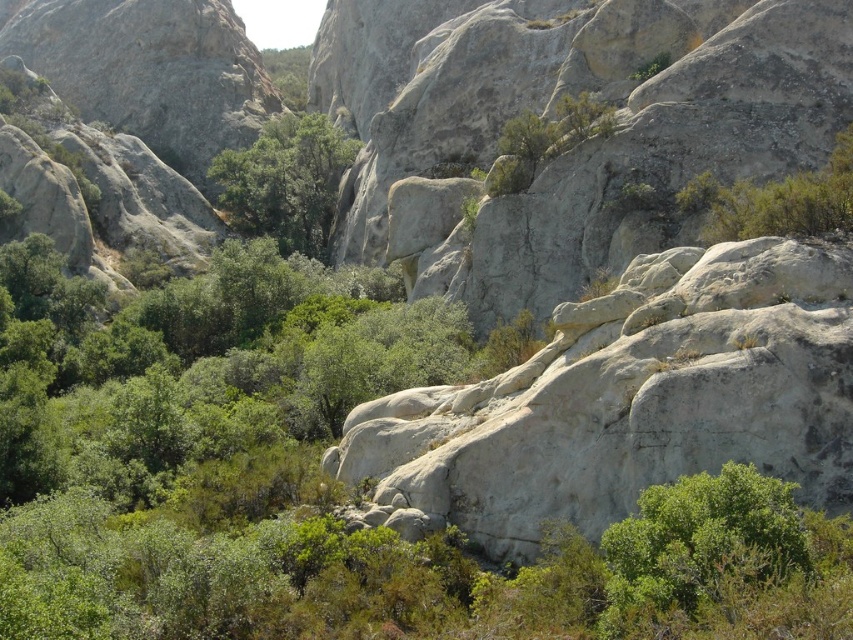
You are a hiker trying to navigate through the dense green vegetation in the foreground. You notice a green leafy tree at center and a green leafy shrub at upper right. Which of these two plants has a wider spread of branches?

The green leafy tree at center has a wider spread of branches than the green leafy shrub at upper right.

You are a hiker trying to navigate between the green leafy tree at center and the green leafy shrub at upper right. Which direction should you move to go from the tree to the shrub?

To move from the green leafy tree at center to the green leafy shrub at upper right, you should move upward since the tree is above the shrub.

You are a hiker planning to take a photo of the green leafy tree at center and the green leafy shrub at upper right. Which one should you focus on first if you want to capture both in a single frame without moving the camera?

You should focus on the green leafy tree at center first because it is taller than the green leafy shrub at upper right, so it will occupy more space in the frame.